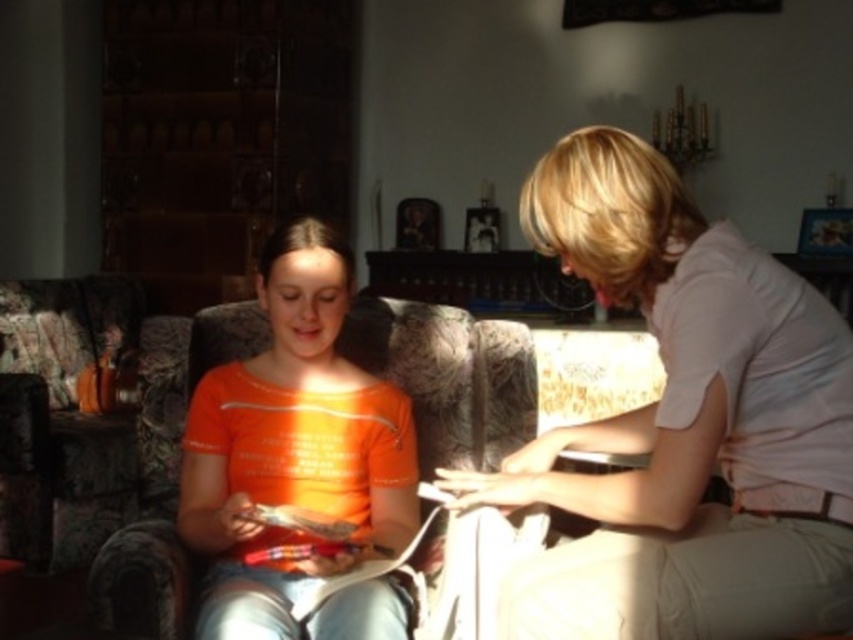
Between light beige cotton shirt at upper right and textured fabric couch at center, which one is positioned lower?

textured fabric couch at center is lower down.

Does light beige cotton shirt at upper right have a larger size compared to textured fabric couch at center?

Incorrect, light beige cotton shirt at upper right is not larger than textured fabric couch at center.

Who is more forward, (683, 609) or (189, 580)?

Positioned in front is point (683, 609).

The image size is (853, 640). What are the coordinates of `light beige cotton shirt at upper right` in the screenshot? It's located at (685, 422).

Does point (198, 388) come behind point (120, 557)?

That is True.

Is point (372, 524) positioned after point (485, 336)?

No, it is not.

Locate an element on the screen. orange cotton shirt at center is located at coordinates (292, 444).

Who is positioned more to the left, light beige cotton shirt at upper right or orange cotton shirt at center?

From the viewer's perspective, orange cotton shirt at center appears more on the left side.

Can you confirm if light beige cotton shirt at upper right is bigger than orange cotton shirt at center?

Yes.

Is point (560, 502) positioned behind point (399, 604)?

No, (560, 502) is in front of (399, 604).

Locate an element on the screen. The width and height of the screenshot is (853, 640). light beige cotton shirt at upper right is located at coordinates (685, 422).